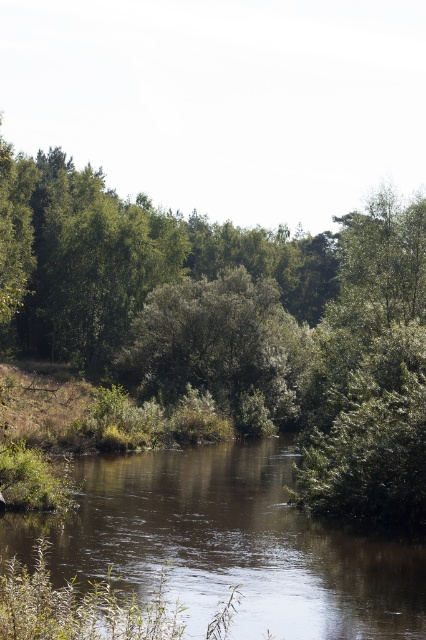
You are a hiker trying to cross the river and need to choose between two paths. One path is near the green leafy forest at center and the other is near the green leafy tree at center. Which path is wider? Please explain your reasoning based on the scene.

The green leafy forest at center is larger than the green leafy tree at center. Since the forest is larger, the area around it likely has more space, making the path near the green leafy forest at center wider than the path near the green leafy tree at center.

You are a bird flying over the green leafy forest at center and the brown smooth water at center. Which one would you see first from above?

The green leafy forest at center is located above the brown smooth water at center, so you would see the green leafy forest at center first when flying over from above.

You are a hiker who wants to cross the river using a fallen tree trunk. You see the brown smooth water at center and the green leafy tree at center. Which object is smaller in size and would be easier to step over?

The brown smooth water at center is smaller than the green leafy tree at center, so it would be easier to step over.